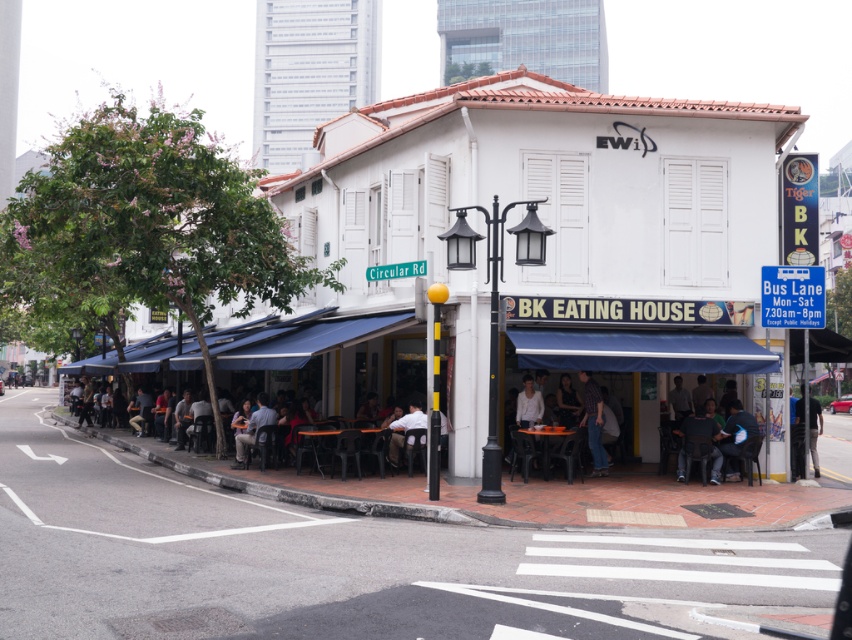
Does plaid shirt at center have a larger size compared to blue fabric umbrella at lower right?

Actually, plaid shirt at center might be smaller than blue fabric umbrella at lower right.

Between point (591, 454) and point (807, 413), which one is positioned in front?

Point (807, 413) is more forward.

The height and width of the screenshot is (640, 852). Identify the location of plaid shirt at center. (593, 422).

Does point (740, 170) come closer to viewer compared to point (298, 429)?

That is True.

Who is more distant from viewer, (222,312) or (309,440)?

Point (222,312)

Is point (686, 310) positioned before point (327, 435)?

That is True.

Image resolution: width=852 pixels, height=640 pixels. What are the coordinates of `white plastic chairs at left` in the screenshot? It's located at point(528,248).

Who is positioned more to the left, white plastic chairs at left or white matte shirt at lower center?

white plastic chairs at left is more to the left.

At what (x,y) coordinates should I click in order to perform the action: click on white plastic chairs at left. Please return your answer as a coordinate pair (x, y). Looking at the image, I should click on (528, 248).

Identify the location of white plastic chairs at left. The image size is (852, 640). (528, 248).